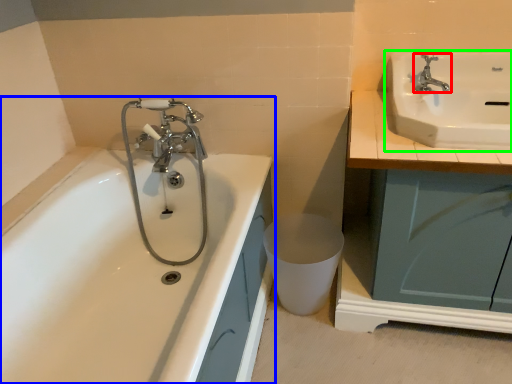
Question: Estimate the real-world distances between objects in this image. Which object is closer to tap (highlighted by a red box), bathtub (highlighted by a blue box) or sink (highlighted by a green box)?

Choices:
 (A) bathtub
 (B) sink

Answer: (B)